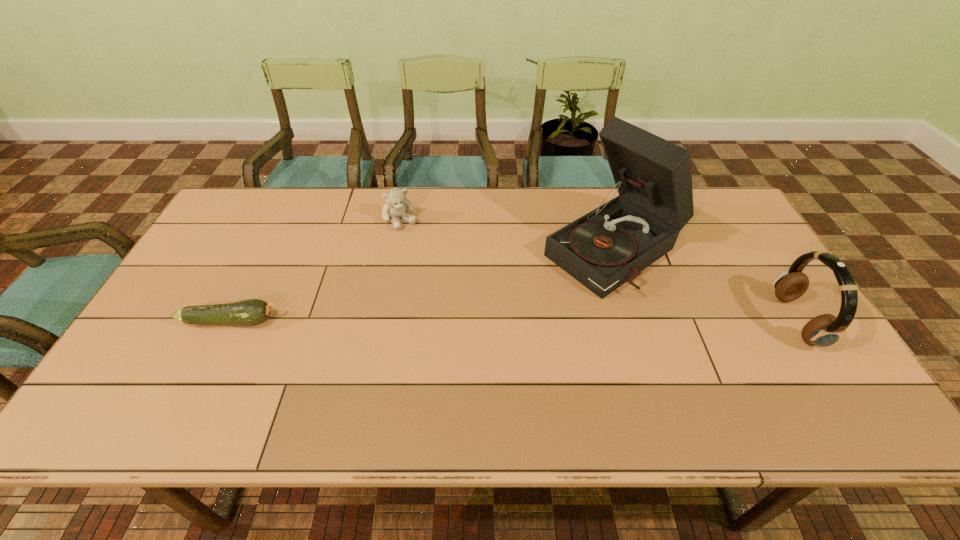
At what (x,y) coordinates should I click in order to perform the action: click on free space that is in between the tallest object and the third object from right to left. Please return your answer as a coordinate pair (x, y). This screenshot has height=540, width=960. Looking at the image, I should click on (508, 235).

Where is `empty space between the zucchini and the rightmost object`? This screenshot has width=960, height=540. empty space between the zucchini and the rightmost object is located at coordinates (514, 321).

Locate an element on the screen. free space between the leftmost object and the rightmost object is located at coordinates point(514,321).

The width and height of the screenshot is (960, 540). What are the coordinates of `vacant space that's between the shortest object and the rightmost object` in the screenshot? It's located at (514, 321).

In order to click on vacant point located between the third shortest object and the zucchini in this screenshot , I will do `click(514, 321)`.

Identify which object is the closest to the headset. Please provide its 2D coordinates. Your answer should be formatted as a tuple, i.e. [(x, y)], where the tuple contains the x and y coordinates of a point satisfying the conditions above.

[(609, 246)]

Image resolution: width=960 pixels, height=540 pixels. In order to click on object that ranks as the second closest to the third tallest object in this screenshot , I will do (609, 246).

Locate an element on the screen. Image resolution: width=960 pixels, height=540 pixels. free space that satisfies the following two spatial constraints: 1. on the front side of the second shortest object; 2. on the ear cup of the rightmost object is located at coordinates (381, 321).

Find the location of a particular element. The height and width of the screenshot is (540, 960). free space that satisfies the following two spatial constraints: 1. on the front side of the phonograph_record; 2. on the ear cup of the headset is located at coordinates (637, 321).